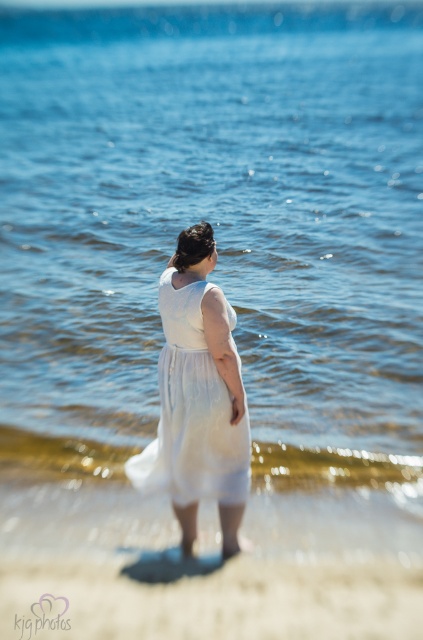
Question: Can you confirm if white sand at lower center is thinner than white sheer dress at center?

Choices:
 (A) yes
 (B) no

Answer: (B)

Question: Which of the following is the farthest from the observer?

Choices:
 (A) white sand at lower center
 (B) white sheer dress at center

Answer: (B)

Question: Can you confirm if white sand at lower center is positioned below white sheer dress at center?

Choices:
 (A) yes
 (B) no

Answer: (A)

Question: Which of the following is the closest to the observer?

Choices:
 (A) (211, 467)
 (B) (343, 572)

Answer: (A)

Question: Is white sand at lower center above white sheer dress at center?

Choices:
 (A) no
 (B) yes

Answer: (A)